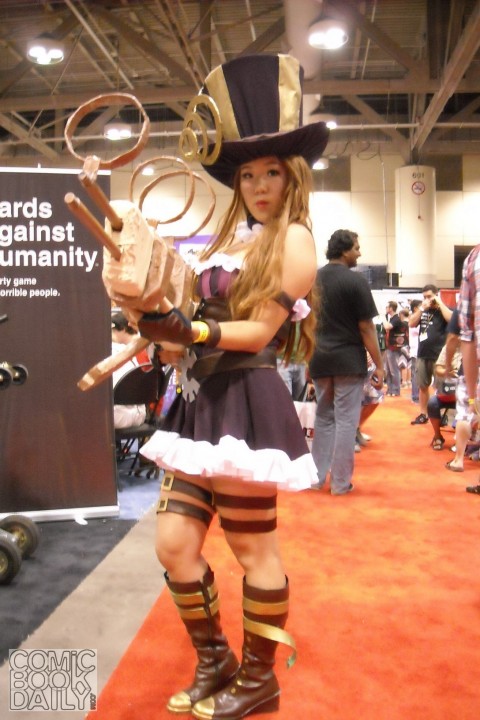
Image resolution: width=480 pixels, height=720 pixels. Identify the location of red carpet. (434, 624).